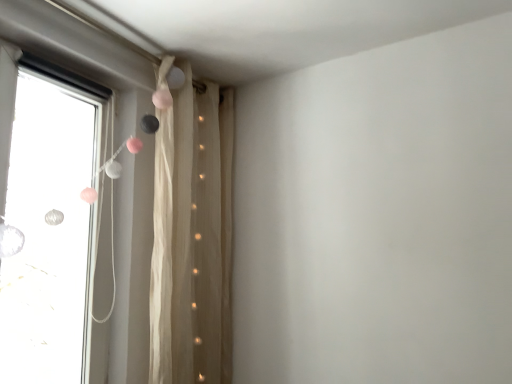
Locate an element on the screen. sheer beige curtain at upper center is located at coordinates (192, 238).

The image size is (512, 384). Describe the element at coordinates (192, 238) in the screenshot. I see `sheer beige curtain at upper center` at that location.

The width and height of the screenshot is (512, 384). What do you see at coordinates (152, 204) in the screenshot? I see `transparent glass window at left` at bounding box center [152, 204].

Find the location of `transparent glass window at left`. transparent glass window at left is located at coordinates (152, 204).

This screenshot has height=384, width=512. I want to click on sheer beige curtain at upper center, so click(192, 238).

Which object is positioned more to the right, transparent glass window at left or sheer beige curtain at upper center?

sheer beige curtain at upper center is more to the right.

Which object is more forward, transparent glass window at left or sheer beige curtain at upper center?

transparent glass window at left is closer to the camera.

Is point (134, 137) closer to viewer compared to point (175, 289)?

No, it is behind (175, 289).

From the image's perspective, which object appears higher, transparent glass window at left or sheer beige curtain at upper center?

From the image's view, transparent glass window at left is above.

From a real-world perspective, which is physically below, transparent glass window at left or sheer beige curtain at upper center?

sheer beige curtain at upper center is physically lower.

Which object is thinner, transparent glass window at left or sheer beige curtain at upper center?

Thinner between the two is transparent glass window at left.

Between transparent glass window at left and sheer beige curtain at upper center, which one has more height?

Standing taller between the two is sheer beige curtain at upper center.

Looking at the image, does transparent glass window at left seem bigger or smaller compared to sheer beige curtain at upper center?

In the image, transparent glass window at left appears to be smaller than sheer beige curtain at upper center.

Is sheer beige curtain at upper center inside transparent glass window at left?

No.

Is transparent glass window at left positioned far away from sheer beige curtain at upper center?

No, transparent glass window at left is not far from sheer beige curtain at upper center.

Is sheer beige curtain at upper center at the back of transparent glass window at left?

No.

How different are the orientations of transparent glass window at left and sheer beige curtain at upper center in degrees?

They differ by 3.4 degrees in their facing directions.

How much distance is there between transparent glass window at left and sheer beige curtain at upper center?

The distance of transparent glass window at left from sheer beige curtain at upper center is 2.33 inches.

In order to click on curtain beneath the transparent glass window at left (from a real-world perspective) in this screenshot , I will do `click(192, 238)`.

Is sheer beige curtain at upper center at the right side of transparent glass window at left?

Yes, sheer beige curtain at upper center is to the right of transparent glass window at left.

Which object is further away from the camera, sheer beige curtain at upper center or transparent glass window at left?

sheer beige curtain at upper center is more distant.

Is point (170, 169) more distant than point (159, 225)?

That is True.

From the image's perspective, is sheer beige curtain at upper center under transparent glass window at left?

Correct, sheer beige curtain at upper center appears lower than transparent glass window at left in the image.

From a real-world perspective, is sheer beige curtain at upper center positioned above or below transparent glass window at left?

From a real-world perspective, sheer beige curtain at upper center is physically below transparent glass window at left.

Which object is wider, sheer beige curtain at upper center or transparent glass window at left?

Wider between the two is sheer beige curtain at upper center.

In the scene shown: In terms of height, does sheer beige curtain at upper center look taller or shorter compared to transparent glass window at left?

In the image, sheer beige curtain at upper center appears to be taller than transparent glass window at left.

Can you confirm if sheer beige curtain at upper center is smaller than transparent glass window at left?

Incorrect, sheer beige curtain at upper center is not smaller in size than transparent glass window at left.

Which is correct: sheer beige curtain at upper center is inside transparent glass window at left, or outside of it?

sheer beige curtain at upper center is outside transparent glass window at left.

Is there a large distance between sheer beige curtain at upper center and transparent glass window at left?

Actually, sheer beige curtain at upper center and transparent glass window at left are a little close together.

Is sheer beige curtain at upper center aimed at transparent glass window at left?

No, sheer beige curtain at upper center is not aimed at transparent glass window at left.

Locate an element on the screen. window located above the sheer beige curtain at upper center (from a real-world perspective) is located at coordinates (152, 204).

What are the coordinates of `window above the sheer beige curtain at upper center (from the image's perspective)` in the screenshot? It's located at (152, 204).

The height and width of the screenshot is (384, 512). What are the coordinates of `window in front of the sheer beige curtain at upper center` in the screenshot? It's located at (152, 204).